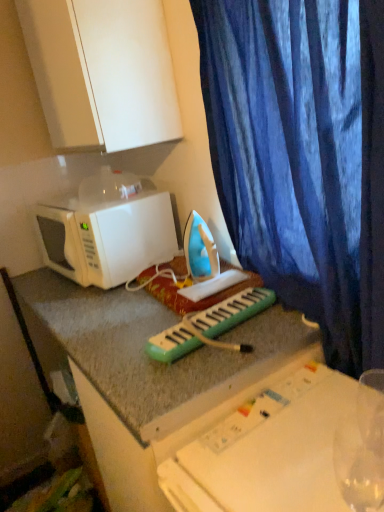
Question: From a real-world perspective, does white matte microwave at left stand above green plastic musical keyboard at center?

Choices:
 (A) no
 (B) yes

Answer: (B)

Question: Is white matte microwave at left far away from green plastic musical keyboard at center?

Choices:
 (A) yes
 (B) no

Answer: (B)

Question: Is white matte microwave at left oriented away from green plastic musical keyboard at center?

Choices:
 (A) no
 (B) yes

Answer: (A)

Question: Considering the relative sizes of white matte microwave at left and green plastic musical keyboard at center in the image provided, is white matte microwave at left taller than green plastic musical keyboard at center?

Choices:
 (A) no
 (B) yes

Answer: (B)

Question: Is white matte microwave at left in contact with green plastic musical keyboard at center?

Choices:
 (A) yes
 (B) no

Answer: (B)

Question: Could you tell me if white matte microwave at left is facing green plastic musical keyboard at center?

Choices:
 (A) no
 (B) yes

Answer: (A)

Question: From a real-world perspective, is white plastic table at center beneath blue velvet curtain at right?

Choices:
 (A) yes
 (B) no

Answer: (A)

Question: Is white plastic table at center outside blue velvet curtain at right?

Choices:
 (A) yes
 (B) no

Answer: (A)

Question: Can you confirm if white plastic table at center is wider than blue velvet curtain at right?

Choices:
 (A) no
 (B) yes

Answer: (B)

Question: Is white plastic table at center facing away from blue velvet curtain at right?

Choices:
 (A) yes
 (B) no

Answer: (B)

Question: From the image's perspective, would you say white plastic table at center is shown under blue velvet curtain at right?

Choices:
 (A) no
 (B) yes

Answer: (B)

Question: Can you confirm if white plastic table at center is positioned to the right of blue velvet curtain at right?

Choices:
 (A) no
 (B) yes

Answer: (B)

Question: Can you confirm if green plastic musical keyboard at center is shorter than white plastic table at center?

Choices:
 (A) yes
 (B) no

Answer: (A)